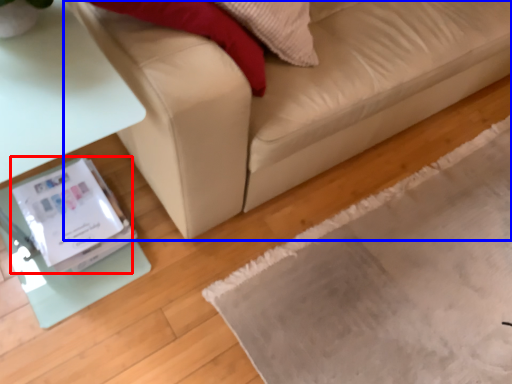
Question: Which object is further to the camera taking this photo, Wii (highlighted by a red box) or studio couch (highlighted by a blue box)?

Choices:
 (A) Wii
 (B) studio couch

Answer: (A)